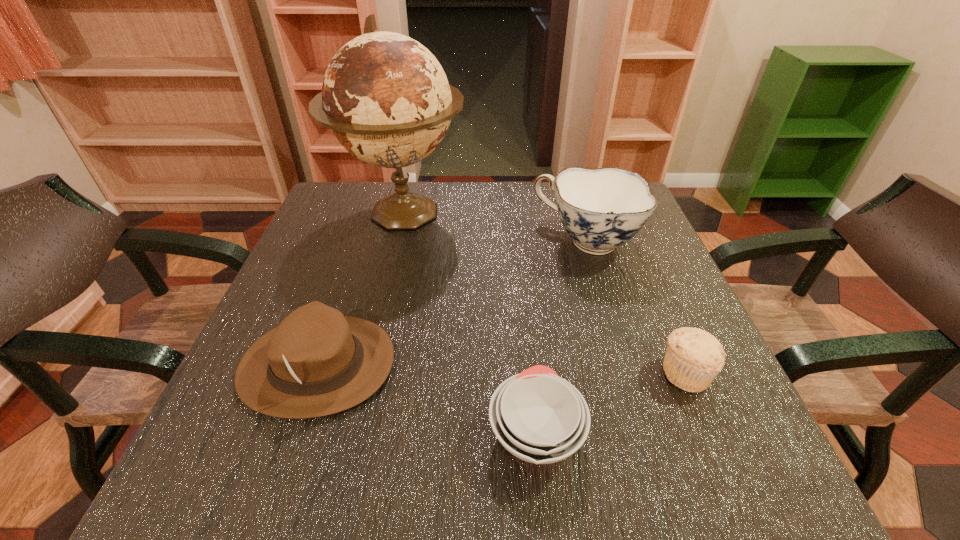
Identify the location of globe. This screenshot has width=960, height=540. (386, 98).

Find the location of a particular element. the second tallest object is located at coordinates (601, 209).

Locate an element on the screen. Image resolution: width=960 pixels, height=540 pixels. fedora is located at coordinates (317, 362).

Image resolution: width=960 pixels, height=540 pixels. Find the location of `muffin`. muffin is located at coordinates (694, 357).

The image size is (960, 540). I want to click on soup bowl, so click(539, 417).

Find the location of a particular element. The image size is (960, 540). free location located on the front of the tallest object showing Asia is located at coordinates (384, 291).

Find the location of a particular element. This screenshot has height=540, width=960. free spot located 0.080m on the front of the chinaware is located at coordinates (603, 296).

You are a GUI agent. You are given a task and a screenshot of the screen. Output one action in this format:
    pyautogui.click(x=<x>, y=<y>)
    Task: Click on the vacant region located on the feather side of the third shortest object
    
    Given the screenshot: What is the action you would take?
    pyautogui.click(x=440, y=364)

Where is `vacant space located on the back of the muffin`? vacant space located on the back of the muffin is located at coordinates (664, 323).

Locate an element on the screen. This screenshot has height=540, width=960. vacant space located 0.150m on the back of the soup bowl is located at coordinates (524, 322).